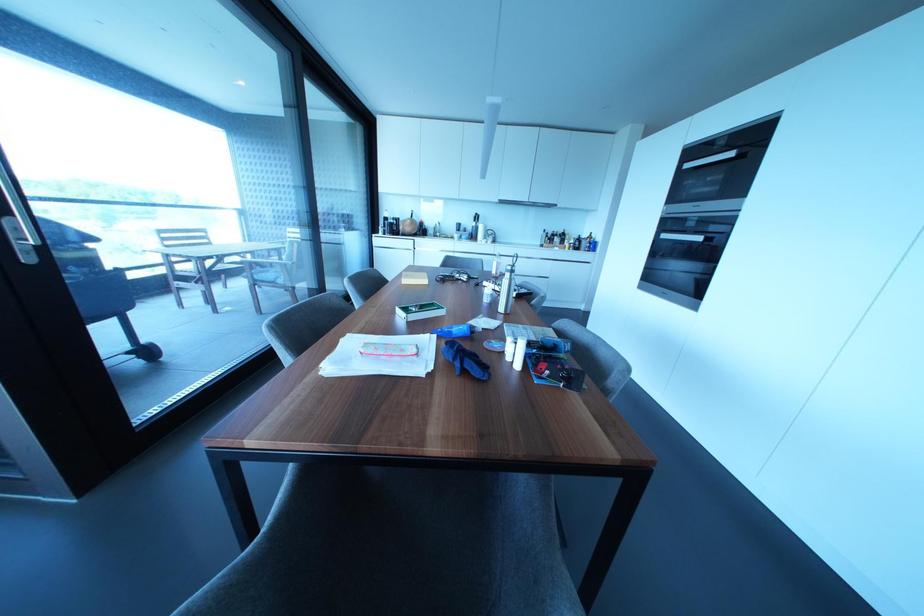
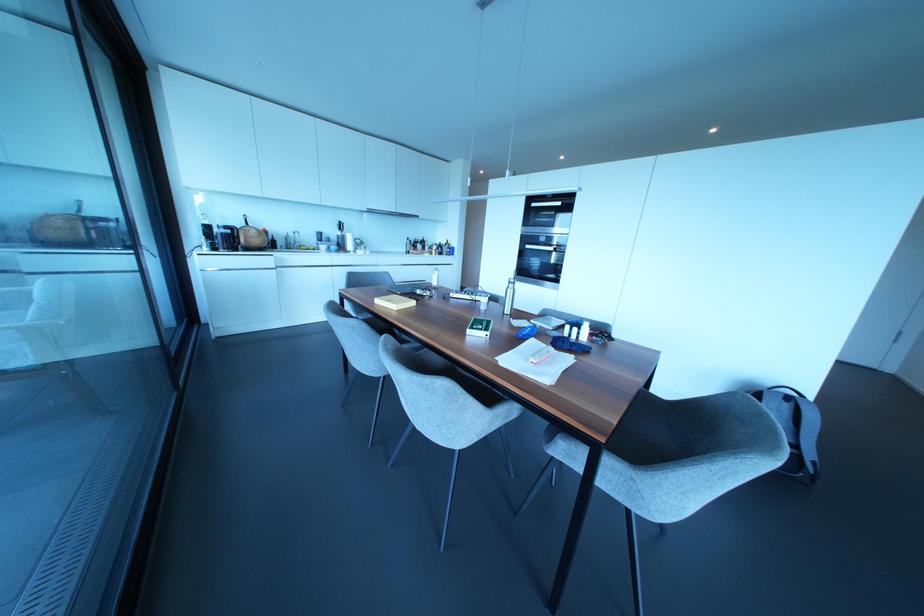
Locate, in the second image, the point that corresponds to point 517,363 in the first image.

(584, 338)